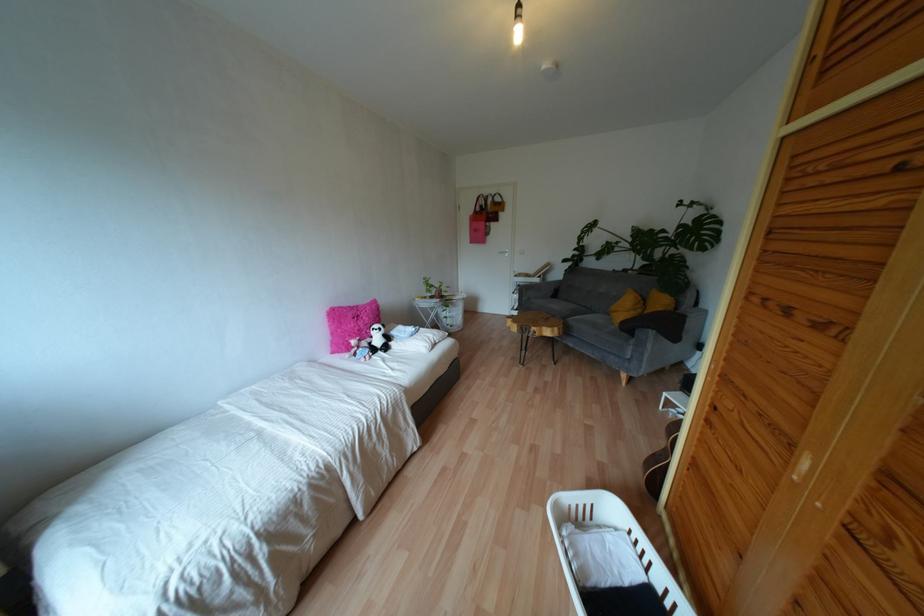
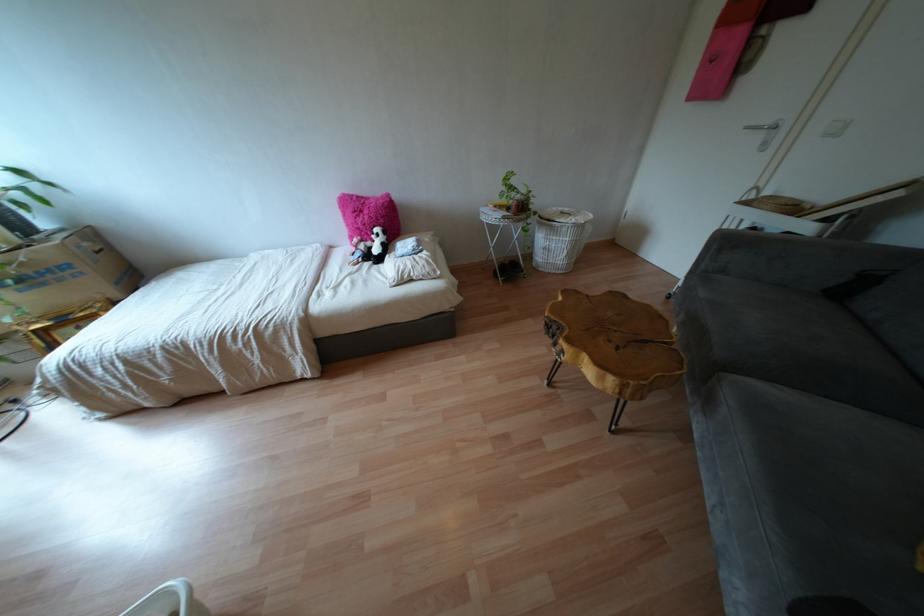
Where in the second image is the point corresponding to the point at 430,297 from the first image?

(506, 208)